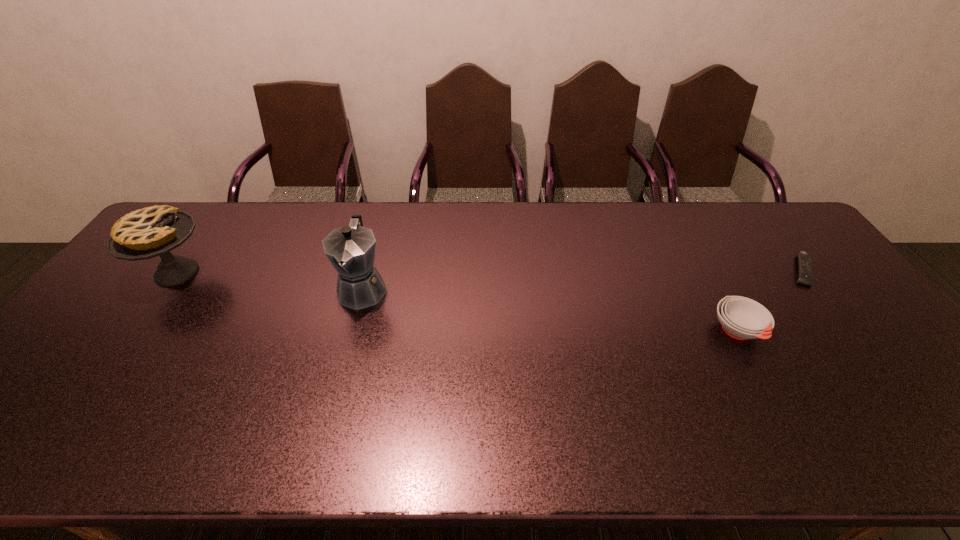
Identify the location of the third object from right to left. (351, 249).

Identify the location of pie. (149, 232).

Where is `the second tallest object`? the second tallest object is located at coordinates (149, 232).

You are a GUI agent. You are given a task and a screenshot of the screen. Output one action in this format:
    pyautogui.click(x=<x>, y=<y>)
    Task: Click on the second shortest object
    The width and height of the screenshot is (960, 540).
    Given the screenshot: What is the action you would take?
    pyautogui.click(x=741, y=318)

Locate an element on the screen. the second object from right to left is located at coordinates (741, 318).

Image resolution: width=960 pixels, height=540 pixels. I want to click on the shortest object, so point(805,272).

The image size is (960, 540). In order to click on the rightmost object in this screenshot , I will do `click(805, 272)`.

Where is `vacant region located at the spout of the coffeepot`? The height and width of the screenshot is (540, 960). vacant region located at the spout of the coffeepot is located at coordinates (349, 338).

Where is `blank area located on the cut side of the leftmost object`? blank area located on the cut side of the leftmost object is located at coordinates (319, 273).

The height and width of the screenshot is (540, 960). Find the location of `vacant space located 0.310m on the left of the third tallest object`. vacant space located 0.310m on the left of the third tallest object is located at coordinates (595, 331).